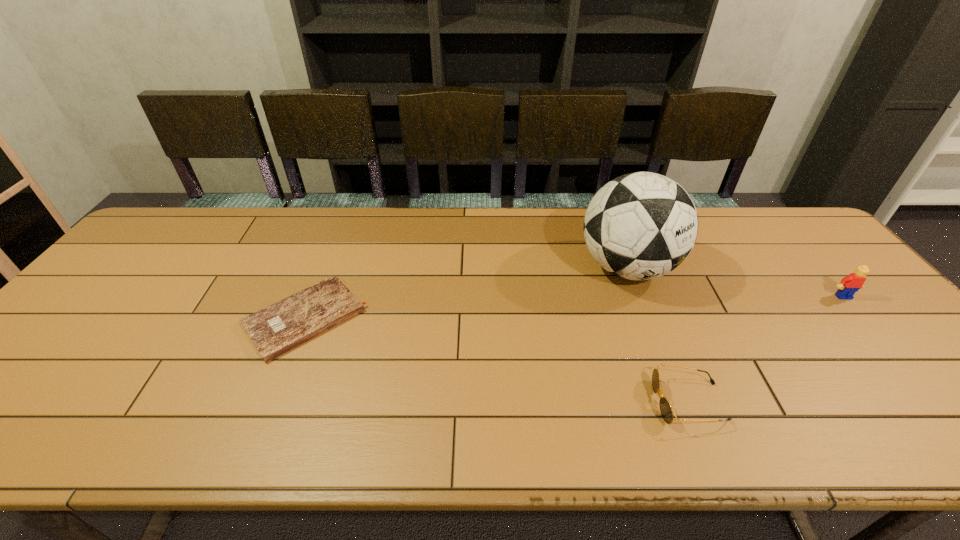
Where is `free location at the far left corner`? This screenshot has width=960, height=540. free location at the far left corner is located at coordinates (209, 212).

The width and height of the screenshot is (960, 540). Identify the location of vacant area that lies between the second shortest object and the Lego. (766, 349).

This screenshot has height=540, width=960. In order to click on empty location between the rightmost object and the soccer ball in this screenshot , I will do `click(735, 282)`.

Locate an element on the screen. free space between the Bible and the soccer ball is located at coordinates (467, 293).

Find the location of `vacant point located between the third shortest object and the leftmost object`. vacant point located between the third shortest object and the leftmost object is located at coordinates (574, 307).

The width and height of the screenshot is (960, 540). I want to click on vacant space that's between the third tallest object and the tallest object, so click(658, 335).

Locate an element on the screen. Image resolution: width=960 pixels, height=540 pixels. empty space that is in between the tallest object and the second tallest object is located at coordinates (735, 282).

Identify the location of unoccupied position between the second shortest object and the tallest object. (658, 335).

I want to click on vacant space that is in between the shortest object and the sunglasses, so click(497, 360).

At what (x,y) coordinates should I click in order to perform the action: click on empty location between the rightmost object and the second shortest object. Please return your answer as a coordinate pair (x, y). Looking at the image, I should click on (766, 349).